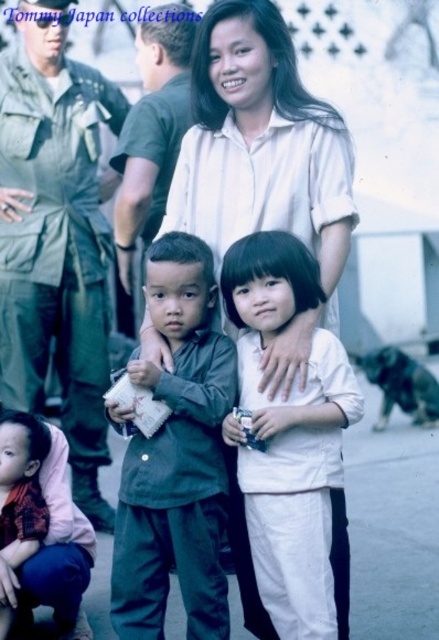
Question: Which point appears closest to the camera in this image?

Choices:
 (A) (100, 397)
 (B) (323, 460)
 (C) (327, 144)

Answer: (B)

Question: Which point appears closest to the camera in this image?

Choices:
 (A) (6, 534)
 (B) (89, 468)
 (C) (244, 336)

Answer: (A)

Question: Can you confirm if white cotton shirt at center is smaller than white matte shirt at center?

Choices:
 (A) no
 (B) yes

Answer: (A)

Question: Is green military uniform at center behind white matte shirt at center?

Choices:
 (A) yes
 (B) no

Answer: (A)

Question: Among these points, which one is nearest to the camera?

Choices:
 (A) (15, 262)
 (B) (290, 384)
 (C) (36, 452)
 (D) (247, 385)

Answer: (B)

Question: Can you confirm if green military uniform at center is wider than white matte shirt at center?

Choices:
 (A) no
 (B) yes

Answer: (B)